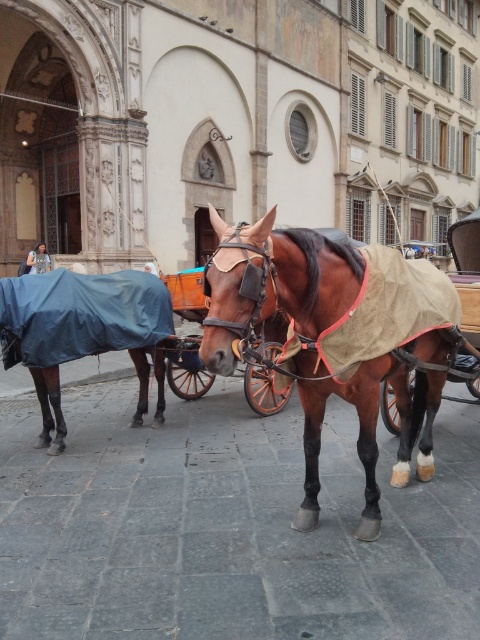
Does brown glossy horse at center come behind blue fabric covered horse at lower left?

No, brown glossy horse at center is in front of blue fabric covered horse at lower left.

Can you confirm if brown glossy horse at center is bigger than blue fabric covered horse at lower left?

Indeed, brown glossy horse at center has a larger size compared to blue fabric covered horse at lower left.

Describe the element at coordinates (317, 342) in the screenshot. Image resolution: width=480 pixels, height=640 pixels. I see `brown glossy horse at center` at that location.

This screenshot has height=640, width=480. Find the location of `brown glossy horse at center`. brown glossy horse at center is located at coordinates (317, 342).